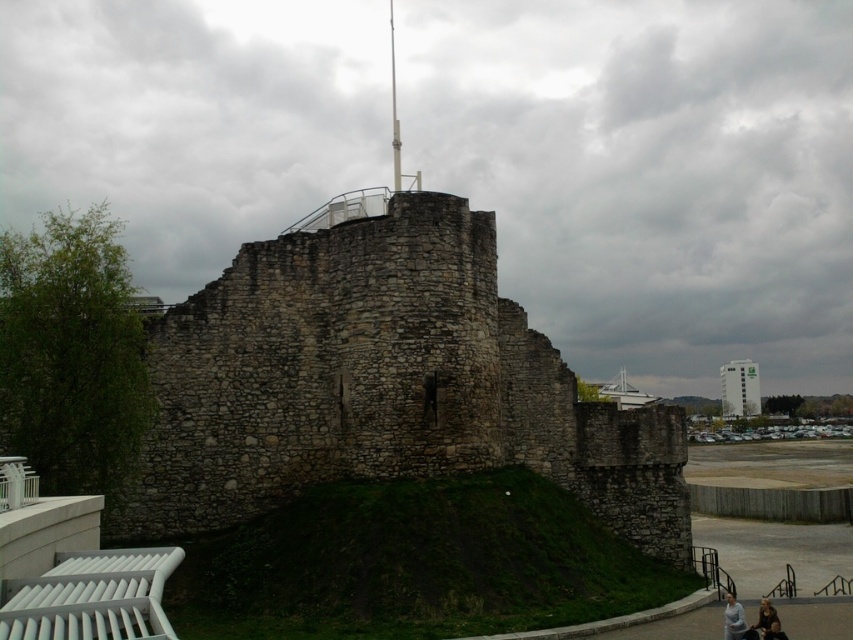
You are a tour guide at the historical stone structure. You notice two visitors, one wearing a light blue shirt at lower right and another in a brown leather jacket at lower right. Which visitor is standing closer to the base of the tall, slender pole atop the structure?

The light blue shirt at lower right is taller than the brown leather jacket at lower right, so the light blue shirt at lower right is closer to the base of the tall, slender pole atop the structure.

You are standing at the base of the historical stone structure and want to take a photo of the two points marked in the image. Which point, point (730,609) or point (769,637), is closer to you?

Point (769,637) is closer to you because it is in front of point (730,609), which is behind it.

You are standing at the base of the historical stone structure and want to take a photo that includes both the green glass building at upper right and the brown leather jacket at lower right. Which object should you position closer to the top of your camera frame?

The green glass building at upper right should be positioned closer to the top of your camera frame because it is taller than the brown leather jacket at lower right.